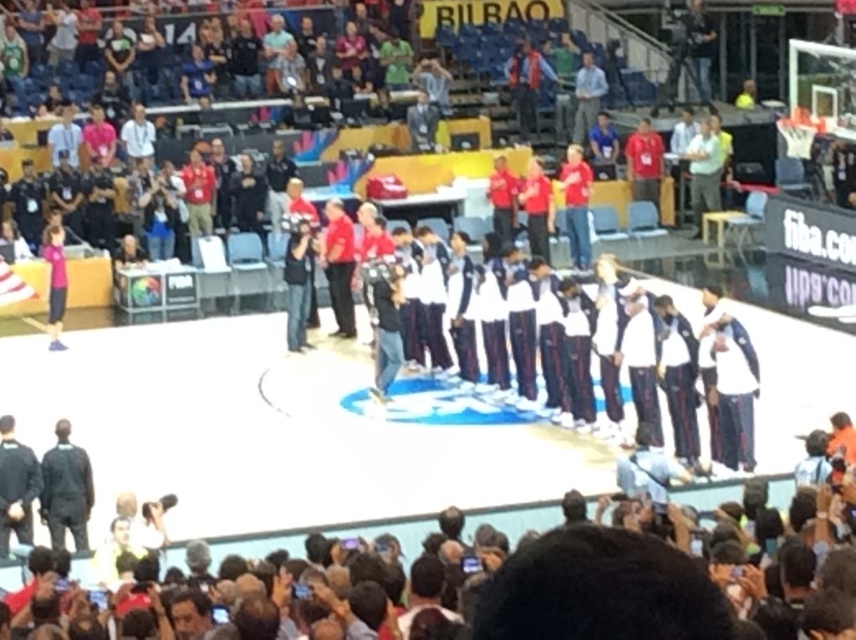
You are a photographer at the basketball game and need to capture a photo of both the white fabric basketball team at center and the dark gray suit at left. Based on their positions, which one should you focus on first to ensure both are in frame?

The white fabric basketball team at center is to the right of the dark gray suit at left, so you should focus on the dark gray suit at left first to ensure both are in frame.

You are a photographer positioned at the back of the arena. You need to capture a photo that includes both the white fabric basketball team at center and the dark gray suit at left. Given their sizes, which object should you focus on first to ensure both are in frame?

The white fabric basketball team at center is smaller in size compared to the dark gray suit at left. To include both in the frame, focus on the dark gray suit at left first as it is larger and adjust the camera angle to include the smaller white fabric basketball team at center.

Based on the scene description, where is the white fabric basketball team at center located in the image?

The white fabric basketball team at center is located at point (x=464, y=403).